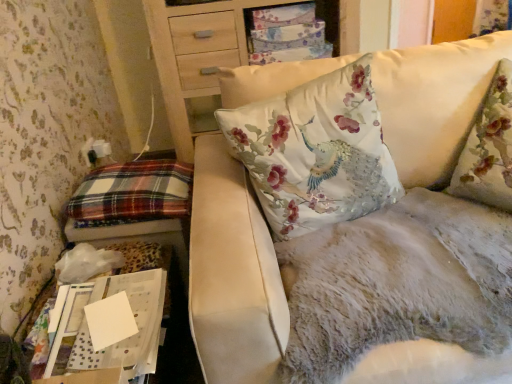
Question: Is fluffy white couch at upper right taller than floral fabric cushion at upper center?

Choices:
 (A) no
 (B) yes

Answer: (B)

Question: Is fluffy white couch at upper right in front of floral fabric cushion at upper center?

Choices:
 (A) yes
 (B) no

Answer: (A)

Question: Can you confirm if fluffy white couch at upper right is wider than floral fabric cushion at upper center?

Choices:
 (A) no
 (B) yes

Answer: (B)

Question: Is fluffy white couch at upper right shorter than floral fabric cushion at upper center?

Choices:
 (A) yes
 (B) no

Answer: (B)

Question: Does fluffy white couch at upper right appear on the right side of floral fabric cushion at upper center?

Choices:
 (A) no
 (B) yes

Answer: (B)

Question: From a real-world perspective, is fluffy white couch at upper right located beneath floral fabric cushion at upper center?

Choices:
 (A) no
 (B) yes

Answer: (B)

Question: From a real-world perspective, is plaid fabric pillow at left beneath white paper at lower left?

Choices:
 (A) yes
 (B) no

Answer: (A)

Question: Is plaid fabric pillow at left taller than white paper at lower left?

Choices:
 (A) no
 (B) yes

Answer: (B)

Question: Does plaid fabric pillow at left have a greater width compared to white paper at lower left?

Choices:
 (A) yes
 (B) no

Answer: (A)

Question: From the image's perspective, would you say plaid fabric pillow at left is positioned over white paper at lower left?

Choices:
 (A) yes
 (B) no

Answer: (A)

Question: Is plaid fabric pillow at left at the left side of white paper at lower left?

Choices:
 (A) no
 (B) yes

Answer: (B)

Question: Is plaid fabric pillow at left oriented away from white paper at lower left?

Choices:
 (A) yes
 (B) no

Answer: (B)

Question: Is floral fabric cushion at upper center not close to plaid fabric pillow at left?

Choices:
 (A) yes
 (B) no

Answer: (B)